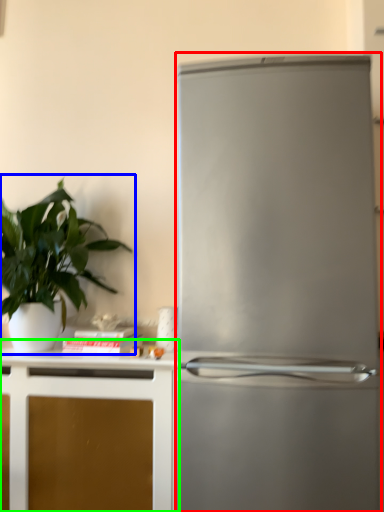
Question: Which object is the closest to the refrigerator (highlighted by a red box)? Choose among these: houseplant (highlighted by a blue box) or cabinetry (highlighted by a green box).

Choices:
 (A) houseplant
 (B) cabinetry

Answer: (B)